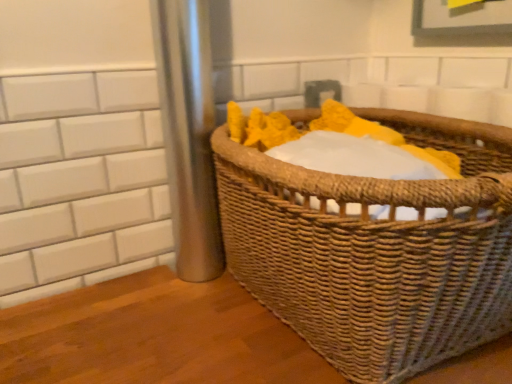
Locate an element on the screen. This screenshot has width=512, height=384. vacant position to the left of woven brown picnic basket at center is located at coordinates (141, 326).